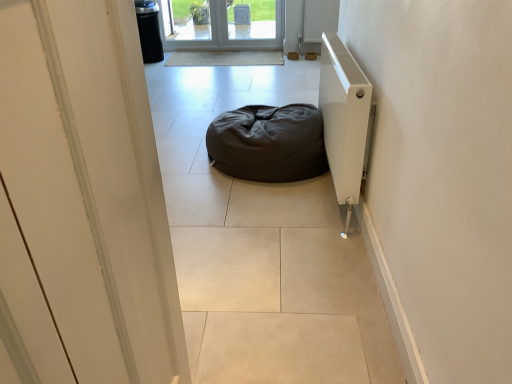
Question: Is white glossy door at upper center oriented towards dark fabric bean bag at center?

Choices:
 (A) yes
 (B) no

Answer: (B)

Question: Is white glossy door at upper center positioned far away from dark fabric bean bag at center?

Choices:
 (A) no
 (B) yes

Answer: (B)

Question: Is white glossy door at upper center to the left of dark fabric bean bag at center from the viewer's perspective?

Choices:
 (A) yes
 (B) no

Answer: (A)

Question: Does white glossy door at upper center have a lesser width compared to dark fabric bean bag at center?

Choices:
 (A) yes
 (B) no

Answer: (A)

Question: Could dark fabric bean bag at center be considered to be inside white glossy door at upper center?

Choices:
 (A) yes
 (B) no

Answer: (B)

Question: Is dark fabric bean bag at center in front of or behind white glossy door at upper center in the image?

Choices:
 (A) front
 (B) behind

Answer: (B)

Question: Would you say dark fabric bean bag at center is inside or outside white glossy door at upper center?

Choices:
 (A) outside
 (B) inside

Answer: (A)

Question: In terms of size, does dark fabric bean bag at center appear bigger or smaller than white glossy door at upper center?

Choices:
 (A) big
 (B) small

Answer: (A)

Question: Is point (294, 175) closer or farther from the camera than point (131, 306)?

Choices:
 (A) farther
 (B) closer

Answer: (A)

Question: Is white textured radiator at right bigger or smaller than white glossy door at upper center?

Choices:
 (A) small
 (B) big

Answer: (B)

Question: Is white textured radiator at right inside the boundaries of white glossy door at upper center, or outside?

Choices:
 (A) inside
 (B) outside

Answer: (B)

Question: Considering the positions of point click(351, 150) and point click(102, 291), is point click(351, 150) closer or farther from the camera than point click(102, 291)?

Choices:
 (A) closer
 (B) farther

Answer: (B)

Question: From a real-world perspective, is white textured radiator at right above or below white glossy door at upper center?

Choices:
 (A) above
 (B) below

Answer: (B)

Question: From the image's perspective, relative to dark fabric bean bag at center, is white glossy door at upper center above or below?

Choices:
 (A) above
 (B) below

Answer: (B)

Question: Is white glossy door at upper center wider or thinner than dark fabric bean bag at center?

Choices:
 (A) thin
 (B) wide

Answer: (A)